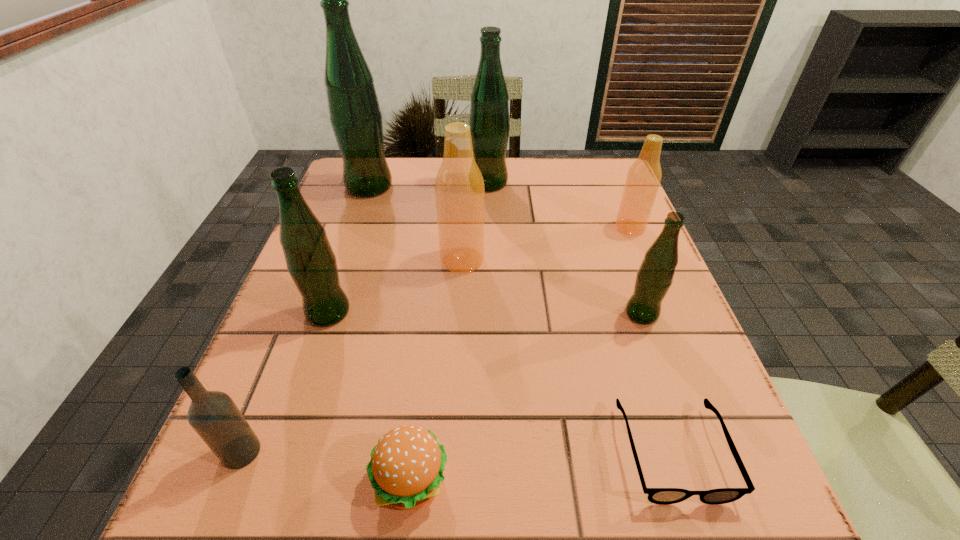
Where is `free spot that satisfies the following two spatial constraints: 1. on the front side of the second smallest green beer bottle; 2. on the right side of the second shortest object`? The width and height of the screenshot is (960, 540). free spot that satisfies the following two spatial constraints: 1. on the front side of the second smallest green beer bottle; 2. on the right side of the second shortest object is located at coordinates (271, 482).